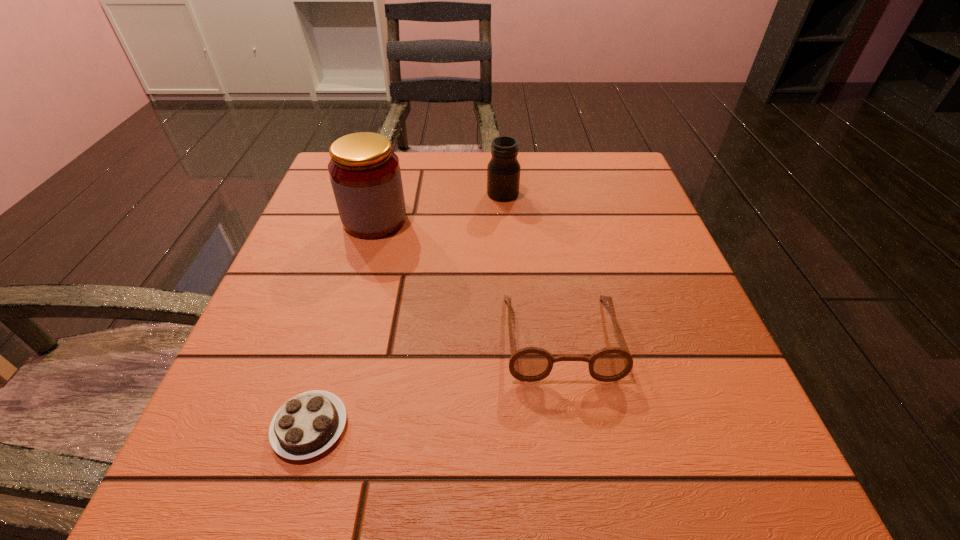
Locate an element on the screen. The width and height of the screenshot is (960, 540). free space between the shortest object and the spectacles is located at coordinates (435, 382).

The image size is (960, 540). In order to click on unoccupied position between the left jar and the second tallest object in this screenshot , I will do `click(439, 207)`.

The width and height of the screenshot is (960, 540). I want to click on free spot between the nearest object and the taller jar, so click(x=343, y=323).

You are a GUI agent. You are given a task and a screenshot of the screen. Output one action in this format:
    pyautogui.click(x=<x>, y=<y>)
    Task: Click on the vacant space in between the left jar and the right jar
    The width and height of the screenshot is (960, 540).
    Given the screenshot: What is the action you would take?
    pyautogui.click(x=439, y=207)

The width and height of the screenshot is (960, 540). Identify the location of vacant area that lies between the taller jar and the shorter jar. (439, 207).

Locate an element on the screen. object that is the closest one to the third tallest object is located at coordinates (308, 424).

Select which object appears as the third closest to the taller jar. Please provide its 2D coordinates. Your answer should be formatted as a tuple, i.e. [(x, y)], where the tuple contains the x and y coordinates of a point satisfying the conditions above.

[(308, 424)]

Find the location of `vacant area in the image that satisfies the following two spatial constraints: 1. on the back side of the taller jar; 2. on the right side of the shortest object`. vacant area in the image that satisfies the following two spatial constraints: 1. on the back side of the taller jar; 2. on the right side of the shortest object is located at coordinates (371, 220).